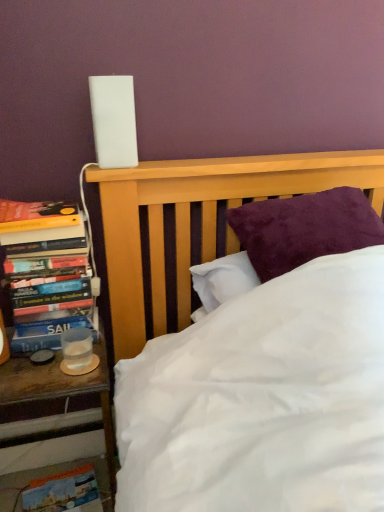
Question: From the image's perspective, does hardcover books at left appear lower than wooden nightstand at left?

Choices:
 (A) yes
 (B) no

Answer: (B)

Question: From the image's perspective, is hardcover books at left on top of wooden nightstand at left?

Choices:
 (A) yes
 (B) no

Answer: (A)

Question: Is the position of hardcover books at left less distant than that of wooden nightstand at left?

Choices:
 (A) yes
 (B) no

Answer: (B)

Question: Is hardcover books at left touching wooden nightstand at left?

Choices:
 (A) no
 (B) yes

Answer: (A)

Question: Does hardcover books at left have a lesser height compared to wooden nightstand at left?

Choices:
 (A) no
 (B) yes

Answer: (B)

Question: Is hardcover books at left smaller than wooden nightstand at left?

Choices:
 (A) no
 (B) yes

Answer: (B)

Question: From a real-world perspective, is clear plastic cup at left located higher than wooden nightstand at left?

Choices:
 (A) no
 (B) yes

Answer: (B)

Question: Considering the relative sizes of clear plastic cup at left and wooden nightstand at left in the image provided, is clear plastic cup at left thinner than wooden nightstand at left?

Choices:
 (A) no
 (B) yes

Answer: (B)

Question: Is clear plastic cup at left at the right side of wooden nightstand at left?

Choices:
 (A) yes
 (B) no

Answer: (A)

Question: Is clear plastic cup at left beside wooden nightstand at left?

Choices:
 (A) no
 (B) yes

Answer: (B)

Question: Can you confirm if clear plastic cup at left is taller than wooden nightstand at left?

Choices:
 (A) yes
 (B) no

Answer: (B)

Question: Is clear plastic cup at left to the left of wooden nightstand at left from the viewer's perspective?

Choices:
 (A) no
 (B) yes

Answer: (A)

Question: Could you tell me if wooden nightstand at left is facing clear plastic cup at left?

Choices:
 (A) yes
 (B) no

Answer: (B)